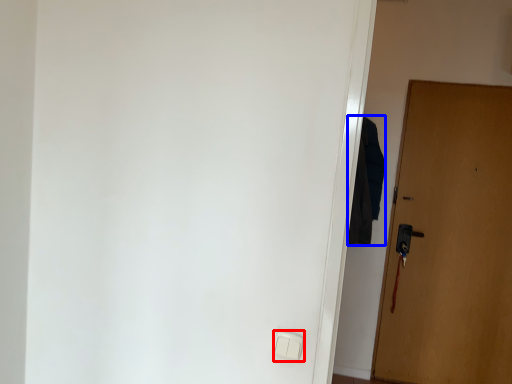
Question: Which point is further to the camera, light switch (highlighted by a red box) or robe (highlighted by a blue box)?

Choices:
 (A) light switch
 (B) robe

Answer: (B)